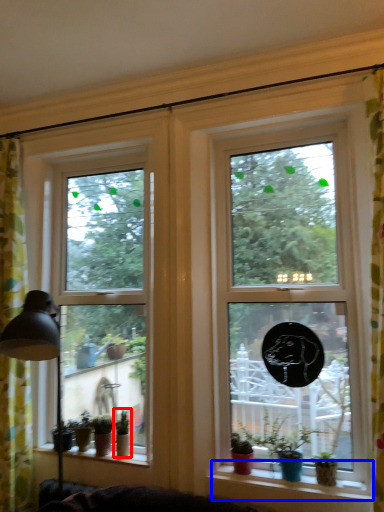
Question: Which object appears farthest to the camera in this image, houseplant (highlighted by a red box) or window sill (highlighted by a blue box)?

Choices:
 (A) houseplant
 (B) window sill

Answer: (A)